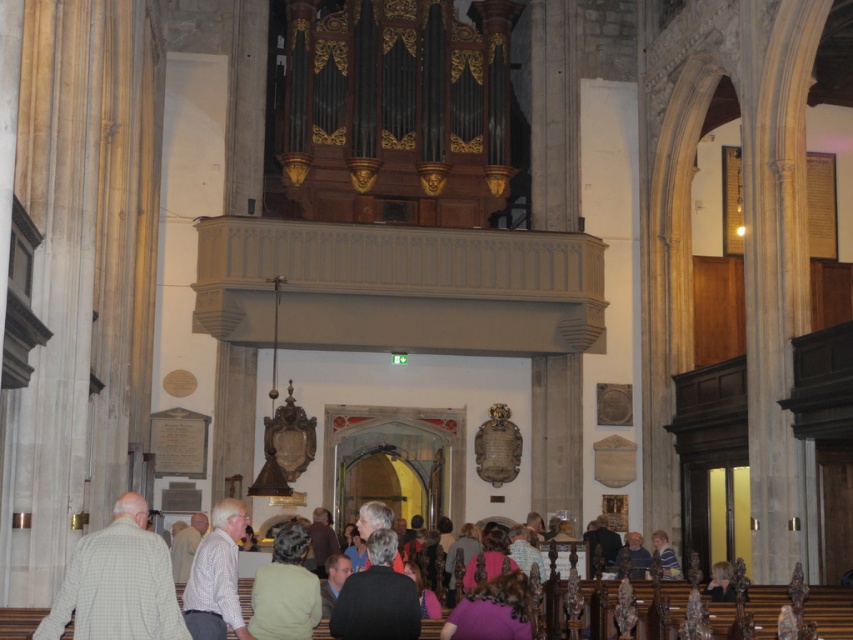
Question: Does light gray checkered shirt at lower left come behind dark gray sweater at lower center?

Choices:
 (A) no
 (B) yes

Answer: (A)

Question: Is light gray checkered shirt at lower left positioned at the back of light brown leather jacket at lower center?

Choices:
 (A) no
 (B) yes

Answer: (A)

Question: Which of the following is the closest to the observer?

Choices:
 (A) (627, 545)
 (B) (276, 618)
 (C) (125, 611)

Answer: (C)

Question: Which of these objects is positioned farthest from the dark gray sweater at lower center?

Choices:
 (A) checkered shirt at center
 (B) light green fabric at lower center
 (C) light brown leather jacket at lower center
 (D) light gray checkered shirt at lower left

Answer: (C)

Question: Which point is farther to the camera?

Choices:
 (A) (132, 561)
 (B) (379, 554)

Answer: (B)

Question: Considering the relative positions of light gray checkered shirt at lower left and checkered shirt at center in the image provided, where is light gray checkered shirt at lower left located with respect to checkered shirt at center?

Choices:
 (A) left
 (B) right

Answer: (B)